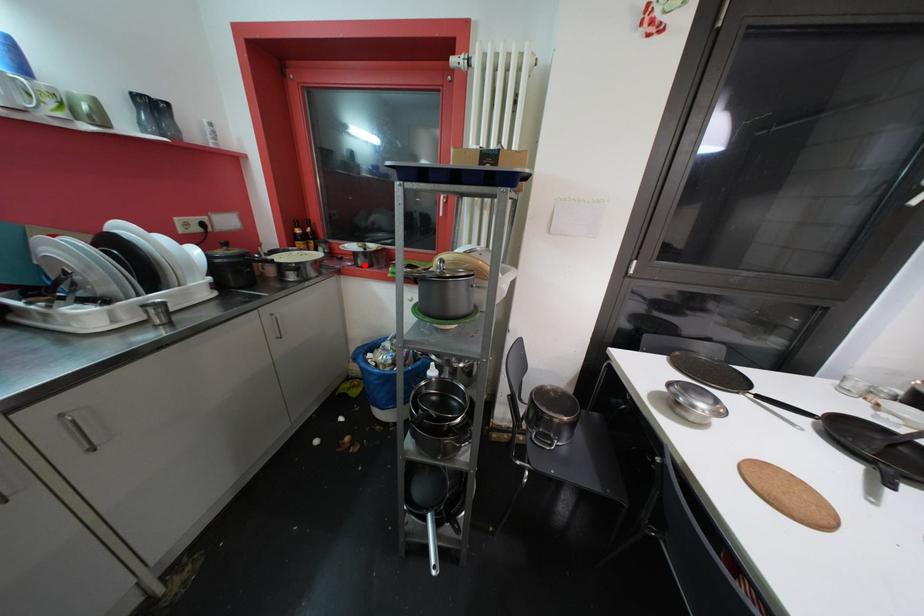
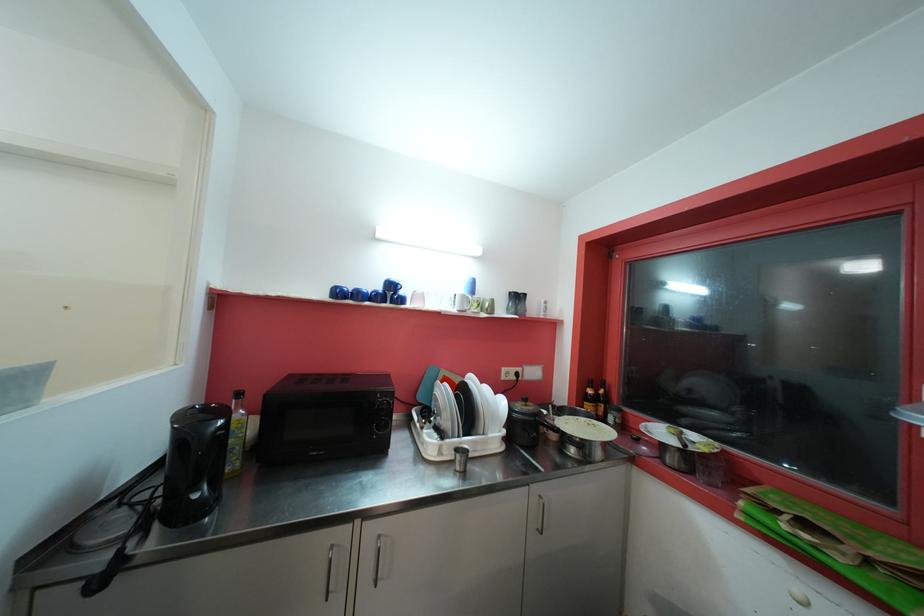
In the second image, find the point that corresponds to the highlighted location in the first image.

(675, 462)